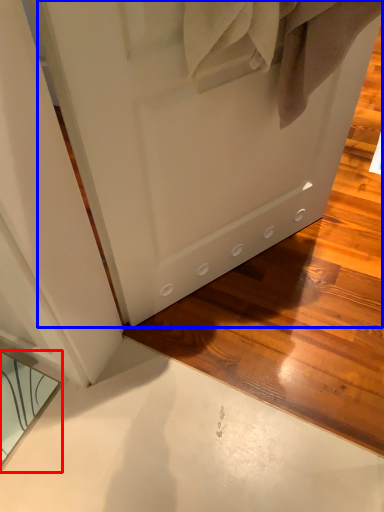
Question: Among these objects, which one is farthest to the camera, mirror (highlighted by a red box) or door (highlighted by a blue box)?

Choices:
 (A) mirror
 (B) door

Answer: (A)